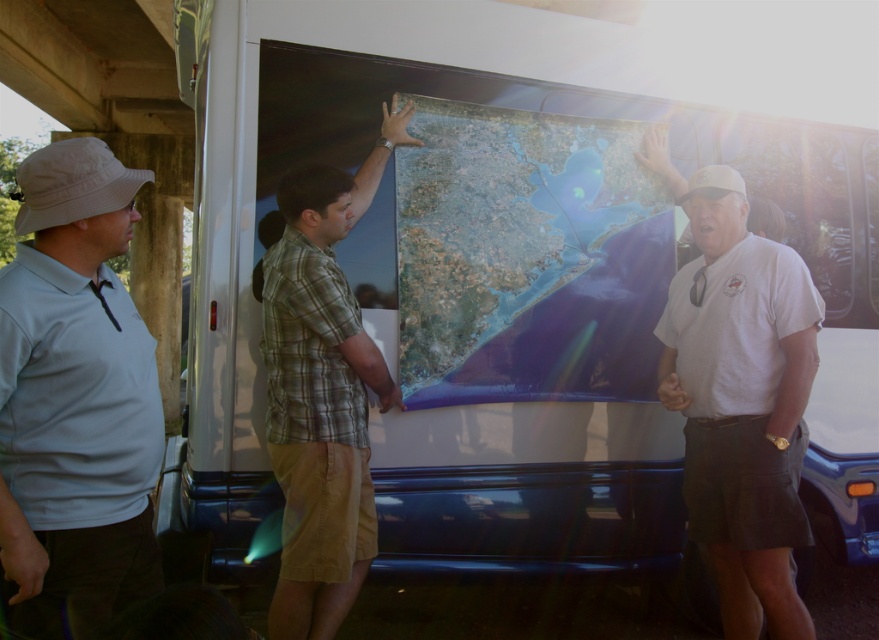
Question: Is satiny blue map at center to the right of white cotton shirt at center from the viewer's perspective?

Choices:
 (A) yes
 (B) no

Answer: (B)

Question: Which point is closer to the camera?

Choices:
 (A) (547, 211)
 (B) (47, 536)
 (C) (300, 492)
 (D) (781, 337)

Answer: (B)

Question: In this image, where is satiny blue map at center located relative to white cotton shirt at center?

Choices:
 (A) below
 (B) above

Answer: (B)

Question: Can you confirm if white matte hat at upper left is thinner than white cotton shirt at center?

Choices:
 (A) yes
 (B) no

Answer: (A)

Question: Estimate the real-world distances between objects in this image. Which object is closer to the green plaid shirt at center?

Choices:
 (A) satiny blue map at center
 (B) white cotton shirt at center

Answer: (A)

Question: Which object is farther from the camera taking this photo?

Choices:
 (A) white matte hat at upper left
 (B) white cotton shirt at center
 (C) green plaid shirt at center
 (D) satiny blue map at center

Answer: (D)